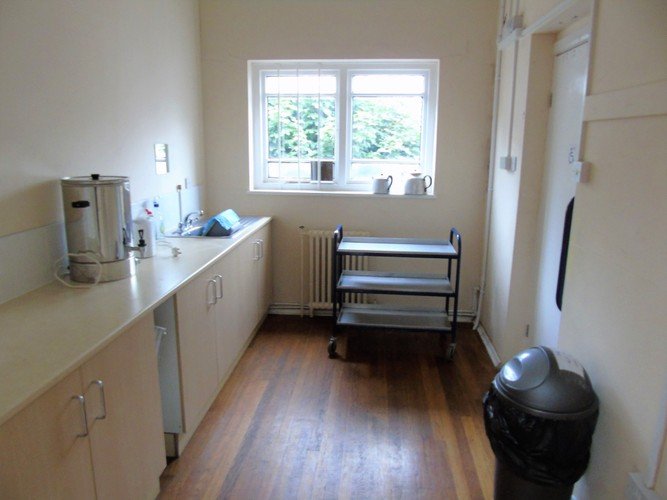
Find the location of `coffee maker`. coffee maker is located at coordinates (105, 227).